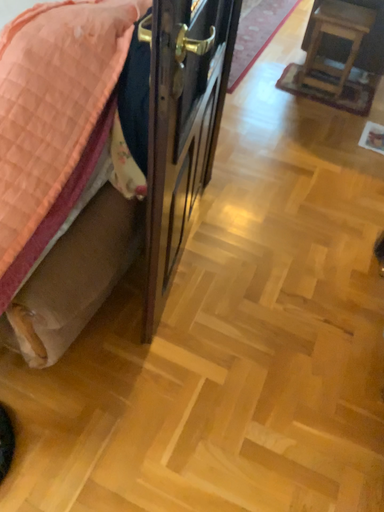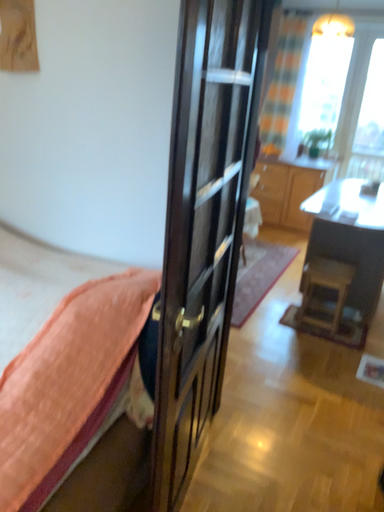
Question: How did the camera likely rotate when shooting the video?

Choices:
 (A) rotated upward
 (B) rotated downward

Answer: (A)